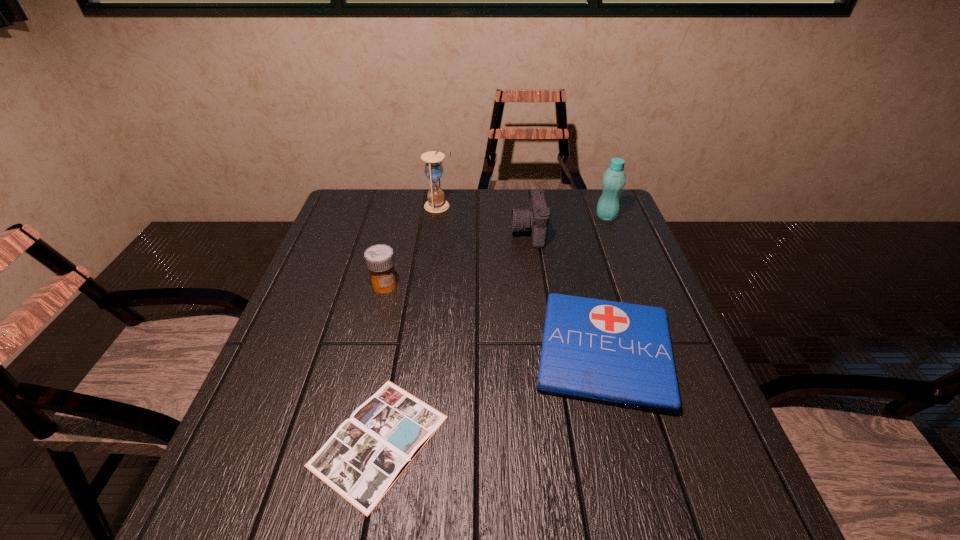
In order to click on vacant space located at the lens of the camera in this screenshot , I will do `click(495, 232)`.

The width and height of the screenshot is (960, 540). Identify the location of vacant space positioned 0.340m on the label side of the medicine. (354, 411).

You are a GUI agent. You are given a task and a screenshot of the screen. Output one action in this format:
    pyautogui.click(x=<x>, y=<y>)
    Task: Click on the vacant region located on the back of the fifth tallest object
    
    Given the screenshot: What is the action you would take?
    580,259

Image resolution: width=960 pixels, height=540 pixels. Find the location of `free point located 0.370m on the right of the shortest object`. free point located 0.370m on the right of the shortest object is located at coordinates (643, 440).

Where is `hourglass at the far edge`? hourglass at the far edge is located at coordinates (433, 168).

You are a GUI agent. You are given a task and a screenshot of the screen. Output one action in this format:
    pyautogui.click(x=<x>, y=<y>)
    Task: Click on the bottle present at the far edge
    This screenshot has width=960, height=540.
    Given the screenshot: What is the action you would take?
    pyautogui.click(x=614, y=178)

The width and height of the screenshot is (960, 540). Identify the location of camera that is at the far edge. (535, 219).

In order to click on object that is at the near edge in this screenshot , I will do `click(364, 457)`.

Where is `object located in the left edge section of the desktop`? object located in the left edge section of the desktop is located at coordinates (364, 457).

At what (x,y) coordinates should I click in order to perform the action: click on bottle situated at the right edge. Please return your answer as a coordinate pair (x, y). The height and width of the screenshot is (540, 960). Looking at the image, I should click on (614, 178).